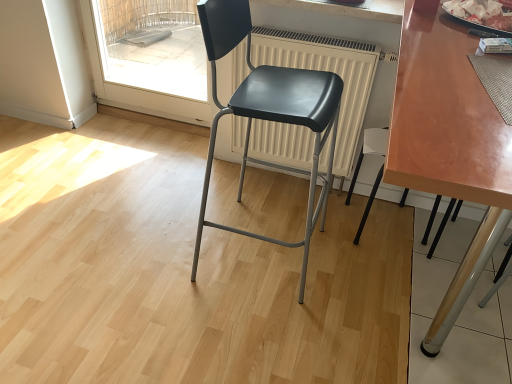
Question: Does matte black chair at center, which is the 1th chair in left-to-right order, have a smaller size compared to white matte radiator at center?

Choices:
 (A) yes
 (B) no

Answer: (B)

Question: Considering the relative sizes of matte black chair at center, the second chair when ordered from right to left, and white matte radiator at center in the image provided, is matte black chair at center, the second chair when ordered from right to left, wider than white matte radiator at center?

Choices:
 (A) yes
 (B) no

Answer: (A)

Question: From a real-world perspective, is matte black chair at center, the second chair when ordered from right to left, beneath white matte radiator at center?

Choices:
 (A) yes
 (B) no

Answer: (B)

Question: Could white matte radiator at center be considered to be inside matte black chair at center, which is the 1th chair in left-to-right order?

Choices:
 (A) yes
 (B) no

Answer: (B)

Question: Is matte black chair at center, which is the 1th chair in left-to-right order, further to camera compared to white matte radiator at center?

Choices:
 (A) yes
 (B) no

Answer: (B)

Question: From a real-world perspective, is transparent glass door at upper left positioned above or below shiny brown table at center?

Choices:
 (A) below
 (B) above

Answer: (A)

Question: Would you say transparent glass door at upper left is inside or outside shiny brown table at center?

Choices:
 (A) inside
 (B) outside

Answer: (B)

Question: Is transparent glass door at upper left wider or thinner than shiny brown table at center?

Choices:
 (A) thin
 (B) wide

Answer: (A)

Question: Considering their positions, is transparent glass door at upper left located in front of or behind shiny brown table at center?

Choices:
 (A) front
 (B) behind

Answer: (B)

Question: Considering the positions of white matte radiator at center and shiny brown table at center in the image, is white matte radiator at center taller or shorter than shiny brown table at center?

Choices:
 (A) tall
 (B) short

Answer: (B)

Question: Considering the positions of white matte radiator at center and shiny brown table at center in the image, is white matte radiator at center bigger or smaller than shiny brown table at center?

Choices:
 (A) small
 (B) big

Answer: (A)

Question: From a real-world perspective, is white matte radiator at center positioned above or below shiny brown table at center?

Choices:
 (A) above
 (B) below

Answer: (B)

Question: In terms of width, does white matte radiator at center look wider or thinner when compared to shiny brown table at center?

Choices:
 (A) thin
 (B) wide

Answer: (A)

Question: From their relative heights in the image, would you say matte black chair at center, which is the 1th chair in left-to-right order, is taller or shorter than white matte radiator at center?

Choices:
 (A) short
 (B) tall

Answer: (B)

Question: Is matte black chair at center, which is the 1th chair in left-to-right order, wider or thinner than white matte radiator at center?

Choices:
 (A) thin
 (B) wide

Answer: (B)